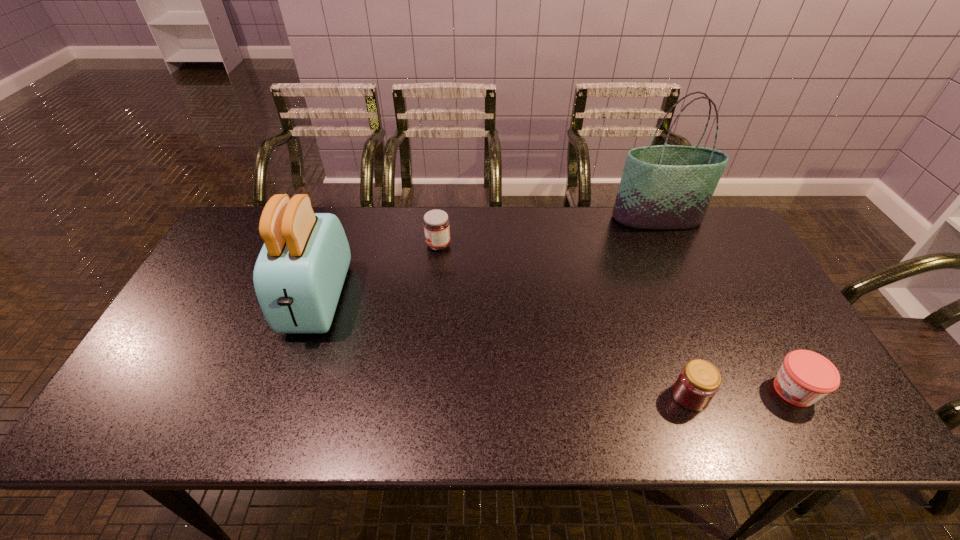
Locate an element on the screen. The width and height of the screenshot is (960, 540). the farthest object is located at coordinates (665, 187).

What are the coordinates of `tote bag` in the screenshot? It's located at (665, 187).

The width and height of the screenshot is (960, 540). Identify the location of the third nearest object. (300, 271).

I want to click on the second tallest object, so (x=300, y=271).

Locate an element on the screen. The image size is (960, 540). the farthest jam is located at coordinates [x=436, y=223].

Find the location of a particular element. the fourth object from right to left is located at coordinates (436, 223).

Locate an element on the screen. This screenshot has height=540, width=960. the second jam from left to right is located at coordinates (698, 382).

Locate an element on the screen. Image resolution: width=960 pixels, height=540 pixels. the rightmost jam is located at coordinates (804, 377).

Where is `blank area located 0.230m on the front of the farthest object`? blank area located 0.230m on the front of the farthest object is located at coordinates (685, 281).

Locate an element on the screen. This screenshot has height=540, width=960. free space located on the side of the toaster with the lever is located at coordinates (291, 374).